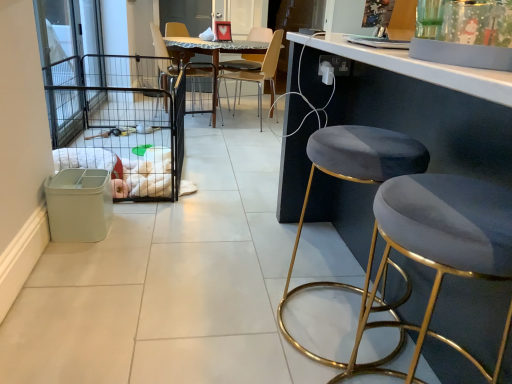
Question: Which direction should I rotate to face metallic brown chair at upper center, the second chair positioned from the right, — up or down?

Choices:
 (A) down
 (B) up

Answer: (B)

Question: From a real-world perspective, does metallic brown chair at upper center, which ranks as the first chair in left-to-right order, sit lower than black wire cage at left?

Choices:
 (A) yes
 (B) no

Answer: (B)

Question: Considering the relative sizes of metallic brown chair at upper center, which ranks as the first chair in left-to-right order, and black wire cage at left in the image provided, is metallic brown chair at upper center, which ranks as the first chair in left-to-right order, bigger than black wire cage at left?

Choices:
 (A) yes
 (B) no

Answer: (B)

Question: Is metallic brown chair at upper center, the second chair positioned from the right, aimed at black wire cage at left?

Choices:
 (A) no
 (B) yes

Answer: (A)

Question: Is black wire cage at left at the back of metallic brown chair at upper center, the second chair positioned from the right?

Choices:
 (A) no
 (B) yes

Answer: (A)

Question: Does metallic brown chair at upper center, which ranks as the first chair in left-to-right order, have a lesser width compared to black wire cage at left?

Choices:
 (A) no
 (B) yes

Answer: (B)

Question: Is metallic brown chair at upper center, the second chair positioned from the right, taller than black wire cage at left?

Choices:
 (A) yes
 (B) no

Answer: (A)

Question: From the image's perspective, would you say velvet/golden stool at right, the 1th stool in the back-to-front sequence, is positioned over wooden chair at center, which is counted as the 1th chair, starting from the right?

Choices:
 (A) no
 (B) yes

Answer: (A)

Question: From the image's perspective, is velvet/golden stool at right, the 1th stool in the back-to-front sequence, located beneath wooden chair at center, which appears as the 2th chair when viewed from the left?

Choices:
 (A) yes
 (B) no

Answer: (A)

Question: Does velvet/golden stool at right, the 1th stool in the back-to-front sequence, have a greater height compared to wooden chair at center, which is counted as the 1th chair, starting from the right?

Choices:
 (A) yes
 (B) no

Answer: (B)

Question: Is velvet/golden stool at right, the 1th stool in the back-to-front sequence, in contact with wooden chair at center, which appears as the 2th chair when viewed from the left?

Choices:
 (A) yes
 (B) no

Answer: (B)

Question: Does velvet/golden stool at right, the 1th stool in the back-to-front sequence, have a smaller size compared to wooden chair at center, which is counted as the 1th chair, starting from the right?

Choices:
 (A) no
 (B) yes

Answer: (B)

Question: Are velvet/golden stool at right, positioned as the second stool in front-to-back order, and wooden chair at center, which appears as the 2th chair when viewed from the left, located far from each other?

Choices:
 (A) no
 (B) yes

Answer: (B)

Question: Does black wire cage at left have a greater width compared to wooden chair at center, which appears as the 2th chair when viewed from the left?

Choices:
 (A) yes
 (B) no

Answer: (A)